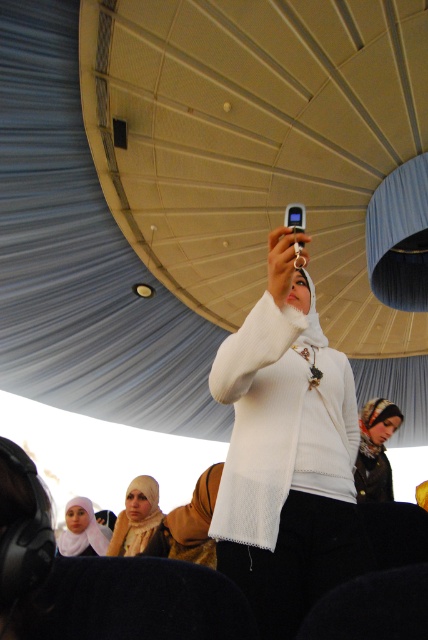
Does white sheer hijab at center appear under matte white hijab at lower center?

No, white sheer hijab at center is not below matte white hijab at lower center.

Is white sheer hijab at center wider than matte white hijab at lower center?

No, white sheer hijab at center is not wider than matte white hijab at lower center.

At what (x,y) coordinates should I click in order to perform the action: click on white sheer hijab at center. Please return your answer as a coordinate pair (x, y). This screenshot has width=428, height=640. Looking at the image, I should click on (136, 516).

Which is in front, point (300, 516) or point (125, 531)?

Point (300, 516) is more forward.

Who is lower down, white mesh scarf at center or white sheer hijab at center?

white sheer hijab at center is lower down.

What do you see at coordinates (285, 452) in the screenshot? The image size is (428, 640). I see `white mesh scarf at center` at bounding box center [285, 452].

Identify the location of white mesh scarf at center. This screenshot has height=640, width=428. (285, 452).

Is white textured scarf at center below matte white hijab at lower center?

Actually, white textured scarf at center is above matte white hijab at lower center.

This screenshot has height=640, width=428. In order to click on white textured scarf at center in this screenshot , I will do `click(376, 451)`.

This screenshot has width=428, height=640. Identify the location of white textured scarf at center. (376, 451).